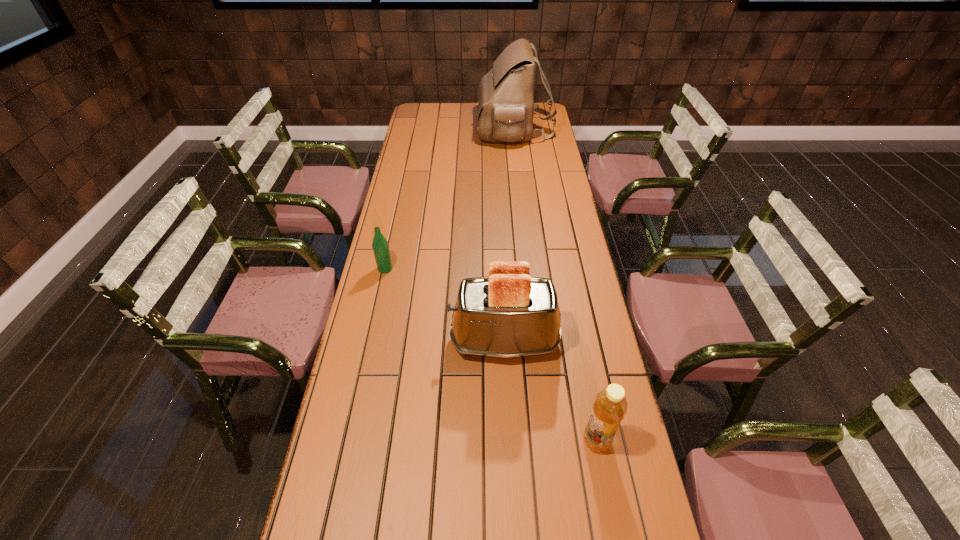
At what (x,y) coordinates should I click in order to perform the action: click on the tallest object. Please return your answer as a coordinate pair (x, y). The height and width of the screenshot is (540, 960). Looking at the image, I should click on (505, 105).

This screenshot has width=960, height=540. Identify the location of satchel. (505, 105).

Locate an element on the screen. The height and width of the screenshot is (540, 960). the third farthest object is located at coordinates (509, 314).

I want to click on toaster, so click(509, 314).

You are a GUI agent. You are given a task and a screenshot of the screen. Output one action in this format:
    pyautogui.click(x=<x>, y=<y>)
    Task: Click on the nearer bottle
    
    Given the screenshot: What is the action you would take?
    click(610, 405)

Identify the location of the right bottle. The width and height of the screenshot is (960, 540). (610, 405).

Locate an element on the screen. This screenshot has height=540, width=960. the left bottle is located at coordinates (380, 245).

In order to click on the farther bottle in this screenshot , I will do `click(380, 245)`.

The image size is (960, 540). In order to click on vacant point located on the front flap of the farthest object in this screenshot , I will do `click(421, 129)`.

Locate an element on the screen. This screenshot has width=960, height=540. free spot located 0.220m on the front flap of the farthest object is located at coordinates (433, 129).